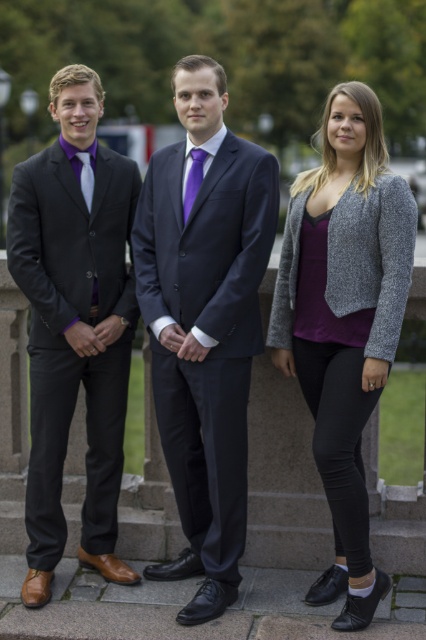
Does knitted gray cardigan at center have a lesser height compared to purple satin tie at center?

No, knitted gray cardigan at center is not shorter than purple satin tie at center.

Does knitted gray cardigan at center appear under purple satin tie at center?

Indeed, knitted gray cardigan at center is positioned under purple satin tie at center.

Which is in front, point (279, 368) or point (184, 192)?

Positioned in front is point (184, 192).

Where is `knitted gray cardigan at center`? This screenshot has width=426, height=640. knitted gray cardigan at center is located at coordinates (345, 321).

Is matte black suit at center taller than knitted gray cardigan at center?

Yes, matte black suit at center is taller than knitted gray cardigan at center.

Identify the location of matte black suit at center. The height and width of the screenshot is (640, 426). (204, 324).

This screenshot has width=426, height=640. In order to click on matte black suit at center in this screenshot , I will do `click(204, 324)`.

Based on the photo, does knitted gray cardigan at center come in front of matte purple tie at center?

Yes, knitted gray cardigan at center is closer to the viewer.

Does knitted gray cardigan at center have a lesser height compared to matte purple tie at center?

No, knitted gray cardigan at center is not shorter than matte purple tie at center.

The image size is (426, 640). In order to click on knitted gray cardigan at center in this screenshot , I will do `click(345, 321)`.